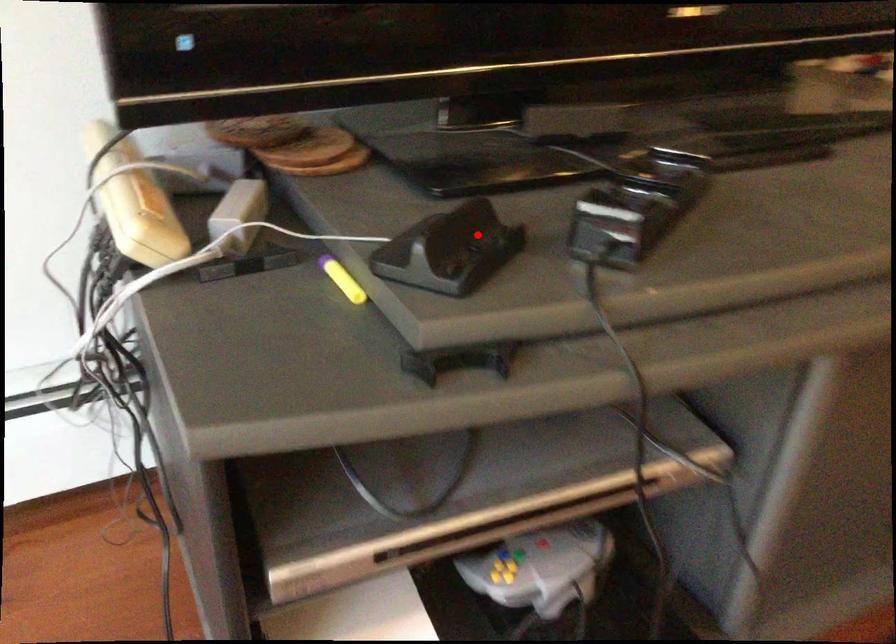
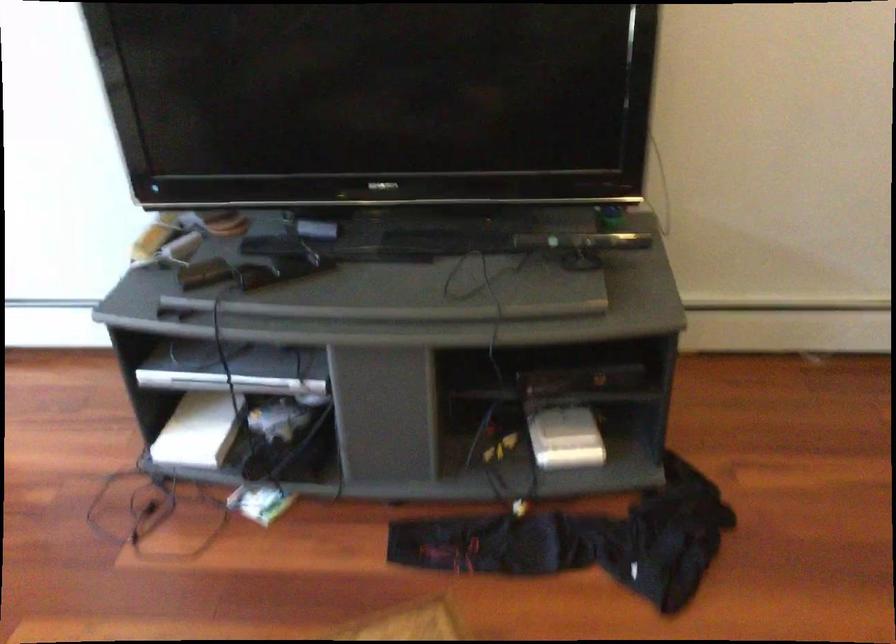
Locate, in the second image, the point that corresponds to the highlighted location in the first image.

(203, 272)